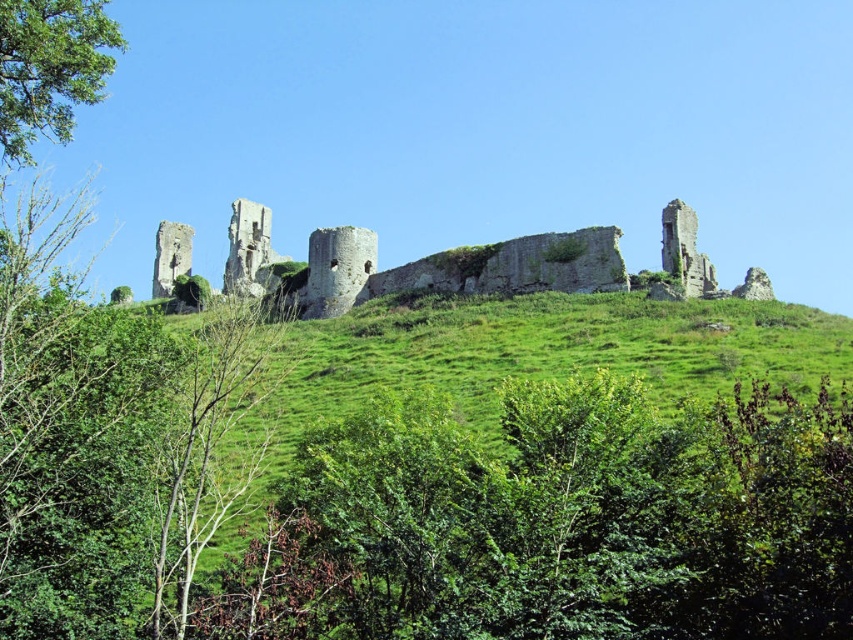
You are an archaeologist examining the medieval castle ruins. You notice the weathered stone ruins at center and the green leafy tree at upper left. Based on their positions, which object is closer to the base of the hill?

The weathered stone ruins at center is located below the green leafy tree at upper left, so it is closer to the base of the hill.

You are a hiker standing at the base of the hill where the weathered stone ruins at center are located. You want to take a photo of the ruins with the green leafy tree at upper left in the background. Will the tree be in focus if you focus on the ruins?

The weathered stone ruins at center is 53.22 meters away from the green leafy tree at upper left. If you focus on the ruins, the tree will likely be out of focus because it is too far behind the main subject for the camera to capture both in sharp focus simultaneously.